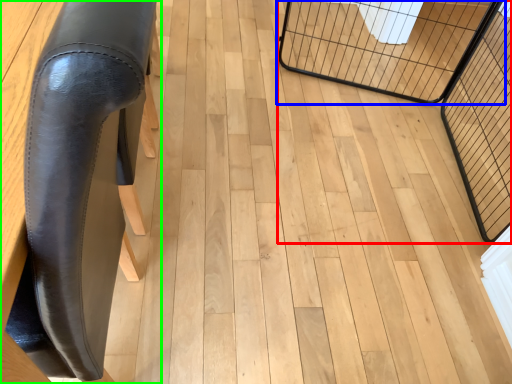
Question: Which object is the farthest from cage (highlighted by a red box)? Choose among these: cage (highlighted by a blue box) or furniture (highlighted by a green box).

Choices:
 (A) cage
 (B) furniture

Answer: (B)